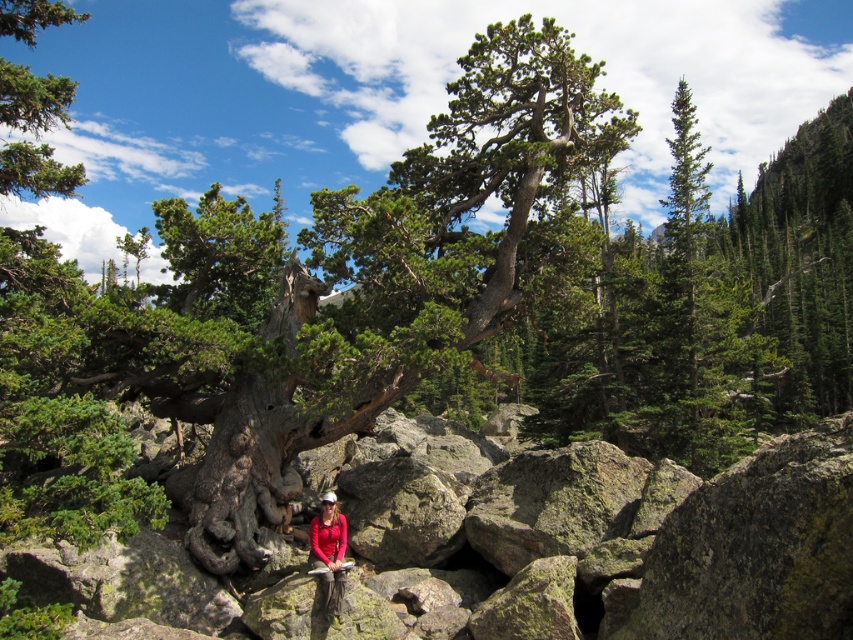
Question: Among these objects, which one is nearest to the camera?

Choices:
 (A) green mossy rock at center
 (B) gray rough boulder at center
 (C) matte red shirt at center

Answer: (A)

Question: Which point is farther to the camera?

Choices:
 (A) pyautogui.click(x=334, y=620)
 (B) pyautogui.click(x=399, y=538)
 (C) pyautogui.click(x=167, y=579)

Answer: (B)

Question: In this image, where is gray rough boulder at center located relative to matte red shirt at center?

Choices:
 (A) above
 (B) below

Answer: (B)

Question: Is green mossy rock at center positioned in front of matte red shirt at center?

Choices:
 (A) yes
 (B) no

Answer: (A)

Question: Is green mossy rock at center thinner than gray rough boulder at center?

Choices:
 (A) yes
 (B) no

Answer: (B)

Question: Which point is farther to the camera?

Choices:
 (A) (329, 524)
 (B) (390, 550)

Answer: (B)